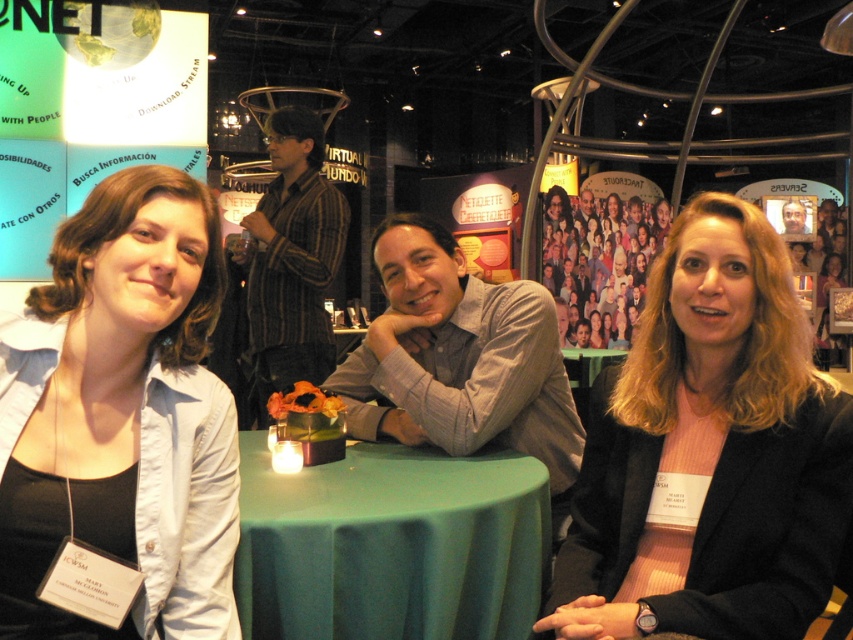
Can you confirm if brown leather jacket at center is taller than matte gray shirt at center?

Indeed, brown leather jacket at center has a greater height compared to matte gray shirt at center.

Is brown leather jacket at center thinner than matte gray shirt at center?

Indeed, brown leather jacket at center has a lesser width compared to matte gray shirt at center.

This screenshot has width=853, height=640. What are the coordinates of `brown leather jacket at center` in the screenshot? It's located at (793, 218).

Locate an element on the screen. This screenshot has height=640, width=853. brown leather jacket at center is located at coordinates (x=793, y=218).

I want to click on blonde hair at center, so click(709, 452).

Does blonde hair at center appear on the right side of matte blue shirt at center?

Correct, you'll find blonde hair at center to the right of matte blue shirt at center.

Find the location of `blonde hair at center`. blonde hair at center is located at coordinates (709, 452).

Can you confirm if blonde hair at center is taller than green fabric tablecloth at center?

Yes.

From the picture: Who is positioned more to the left, blonde hair at center or green fabric tablecloth at center?

green fabric tablecloth at center

Is point (631, 392) more distant than point (358, 560)?

Yes, it is behind point (358, 560).

Identify the location of blonde hair at center. (709, 452).